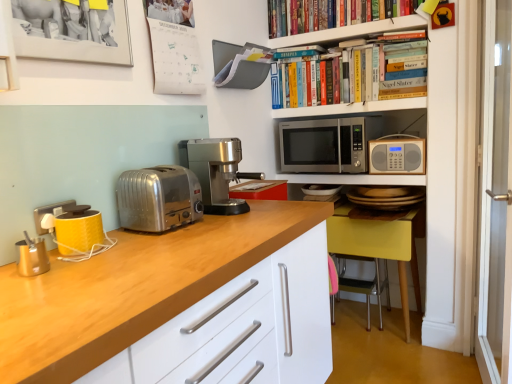
Question: Based on their sizes in the image, would you say polished stainless steel coffee machine at center, which appears as the second coffee machine when viewed from the front, is bigger or smaller than hardcover books at upper center, the 1th shelf ordered from the bottom?

Choices:
 (A) big
 (B) small

Answer: (B)

Question: Is polished stainless steel coffee machine at center, the first coffee machine viewed from the back, in front of or behind hardcover books at upper center, the 1th shelf ordered from the bottom, in the image?

Choices:
 (A) front
 (B) behind

Answer: (A)

Question: Considering the real-world distances, which object is closest to the yellow matte coffee machine at left, which is the 1th coffee machine in front-to-back order?

Choices:
 (A) yellow wood chair at lower right, which is the 2th chair in back-to-front order
 (B) polished stainless steel coffee machine at center, which appears as the second coffee machine when viewed from the front
 (C) hardcover books at upper center, the 1th shelf ordered from the bottom
 (D) matte black picture frame at upper left
 (E) transparent glass door at right

Answer: (D)

Question: Which object is positioned closest to the satin silver toaster at left?

Choices:
 (A) yellow matte coffee machine at left, which ranks as the 1th coffee machine in left-to-right order
 (B) transparent glass door at right
 (C) hardcover books at upper center, positioned as the second shelf in bottom-to-top order
 (D) hardcover books at upper center, marked as the second shelf in a top-to-bottom arrangement
 (E) yellow fabric chair at lower right, the 1th chair positioned from the back

Answer: (A)